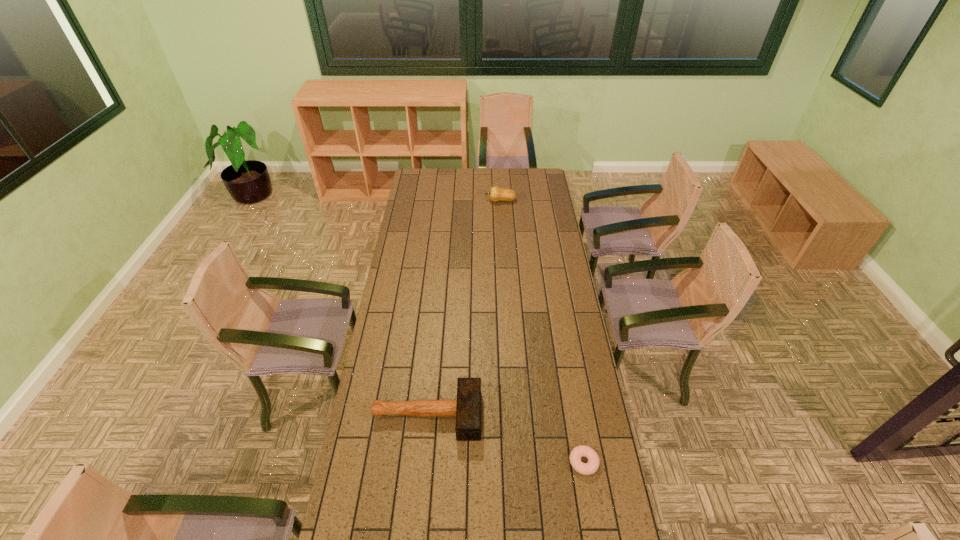
Image resolution: width=960 pixels, height=540 pixels. Identify the location of gourd. (496, 193).

Find the location of `the farthest object`. the farthest object is located at coordinates (496, 193).

What are the coordinates of `the second farthest object` in the screenshot? It's located at (467, 408).

Locate an element on the screen. The width and height of the screenshot is (960, 540). mallet is located at coordinates (467, 408).

Locate an element on the screen. The image size is (960, 540). doughnut is located at coordinates (591, 467).

In order to click on the nearest object in this screenshot , I will do click(591, 467).

Identify the location of blank space located on the stem side of the gourd. The width and height of the screenshot is (960, 540). (435, 201).

I want to click on free space located on the stem side of the gourd, so click(x=425, y=201).

You are a GUI agent. You are given a task and a screenshot of the screen. Output one action in this format:
    pyautogui.click(x=<x>, y=<y>)
    Task: Click on the vacant space located 0.180m on the stem side of the gourd
    
    Given the screenshot: What is the action you would take?
    pyautogui.click(x=455, y=201)

The height and width of the screenshot is (540, 960). I want to click on free space located on the hammer head face of the leftmost object, so click(537, 414).